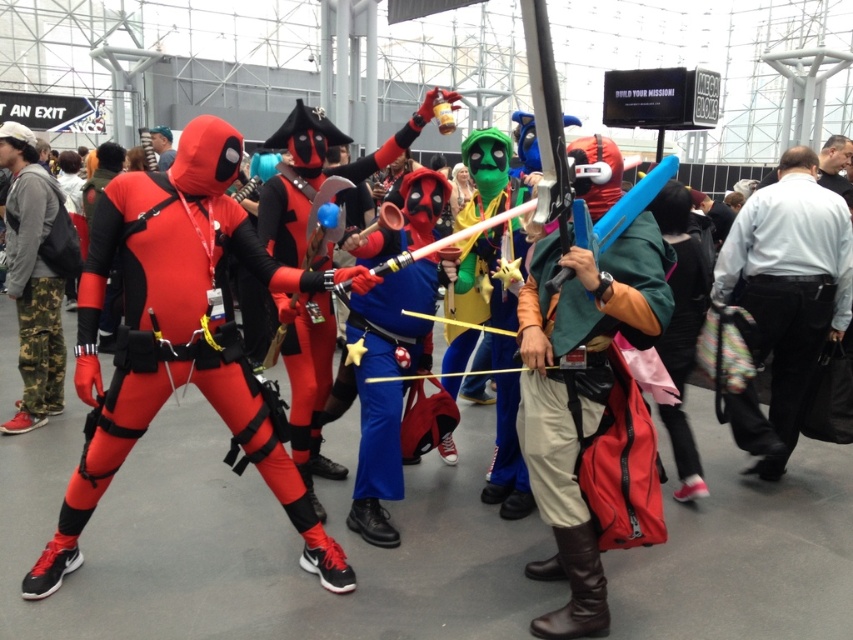
Question: Where is camo pants at left located in relation to matte black shirt at upper center in the image?

Choices:
 (A) right
 (B) left

Answer: (A)

Question: Estimate the real-world distances between objects in this image. Which object is closer to the light blue shirt at right?

Choices:
 (A) matte black shirt at upper center
 (B) camo pants at left
 (C) matte spandex suit at center

Answer: (C)

Question: Considering the real-world distances, which object is closest to the light blue shirt at right?

Choices:
 (A) matte black shirt at upper center
 (B) camo pants at left

Answer: (B)

Question: Which point is farther to the camera?

Choices:
 (A) light blue shirt at right
 (B) matte spandex suit at center
 (C) black leather jacket at upper right
 (D) matte black shirt at upper center

Answer: (D)

Question: Is light blue shirt at right positioned at the back of matte black shirt at upper center?

Choices:
 (A) yes
 (B) no

Answer: (B)

Question: Can you confirm if matte spandex suit at center is smaller than light blue shirt at right?

Choices:
 (A) no
 (B) yes

Answer: (A)